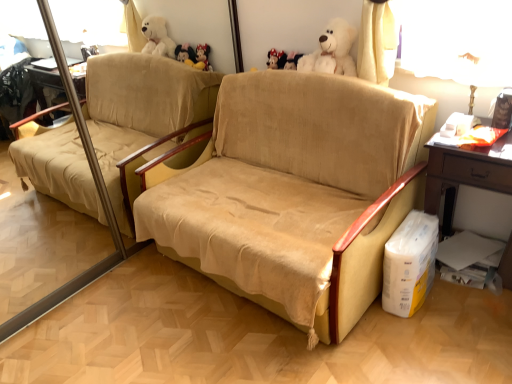
Describe the element at coordinates (465, 173) in the screenshot. This screenshot has width=512, height=384. I see `wooden table at right` at that location.

Where is `fluffy white teddy bear at upper center`? fluffy white teddy bear at upper center is located at coordinates (332, 51).

Find the location of a particular element. The height and width of the screenshot is (384, 512). wooden table at right is located at coordinates (465, 173).

Would you say white cardboard box at lower right is to the left or to the right of beige suede couch at center in the picture?

In the image, white cardboard box at lower right appears on the right side of beige suede couch at center.

Considering the relative sizes of white cardboard box at lower right and beige suede couch at center in the image provided, is white cardboard box at lower right shorter than beige suede couch at center?

Indeed, white cardboard box at lower right has a lesser height compared to beige suede couch at center.

Is white cardboard box at lower right spatially inside beige suede couch at center, or outside of it?

white cardboard box at lower right is not inside beige suede couch at center, it's outside.

In the image, is white cardboard box at lower right positioned in front of or behind metallic gold table lamp at upper right?

white cardboard box at lower right is positioned farther from the viewer than metallic gold table lamp at upper right.

In the scene shown: Considering the relative positions of white cardboard box at lower right and metallic gold table lamp at upper right in the image provided, is white cardboard box at lower right to the left of metallic gold table lamp at upper right from the viewer's perspective?

Indeed, white cardboard box at lower right is positioned on the left side of metallic gold table lamp at upper right.

Is white cardboard box at lower right far away from metallic gold table lamp at upper right?

No, white cardboard box at lower right is not far away from metallic gold table lamp at upper right.

Considering the positions of objects white cardboard box at lower right and wooden table at right in the image provided, who is more to the left, white cardboard box at lower right or wooden table at right?

From the viewer's perspective, white cardboard box at lower right appears more on the left side.

Does white cardboard box at lower right lie behind wooden table at right?

Yes, white cardboard box at lower right is behind wooden table at right.

Does point (414, 250) come in front of point (489, 155)?

No, it is behind (489, 155).

Is white cardboard box at lower right facing away from wooden table at right?

Yes, white cardboard box at lower right's orientation is away from wooden table at right.

Would you say wooden table at right is inside or outside beige suede couch at center?

wooden table at right is located beyond the bounds of beige suede couch at center.

From a real-world perspective, is wooden table at right located beneath beige suede couch at center?

Yes.

Based on the photo, which object is thinner, wooden table at right or beige suede couch at center?

Thinner between the two is wooden table at right.

Is wooden table at right far from beige suede couch at center?

No.

Between metallic gold table lamp at upper right and fluffy white teddy bear at upper center, which one has smaller width?

With smaller width is metallic gold table lamp at upper right.

Considering the relative sizes of metallic gold table lamp at upper right and fluffy white teddy bear at upper center in the image provided, is metallic gold table lamp at upper right taller than fluffy white teddy bear at upper center?

Yes.

Is metallic gold table lamp at upper right closer to the viewer compared to fluffy white teddy bear at upper center?

Yes, metallic gold table lamp at upper right is closer to the camera.

Considering the sizes of metallic gold table lamp at upper right and fluffy white teddy bear at upper center in the image, is metallic gold table lamp at upper right bigger or smaller than fluffy white teddy bear at upper center?

Considering their sizes, metallic gold table lamp at upper right takes up less space than fluffy white teddy bear at upper center.

From the picture: Which of these two, beige suede couch at center or metallic gold table lamp at upper right, is wider?

beige suede couch at center is wider.

From the image's perspective, between beige suede couch at center and metallic gold table lamp at upper right, who is located below?

beige suede couch at center is shown below in the image.

Does beige suede couch at center appear on the right side of metallic gold table lamp at upper right?

Incorrect, beige suede couch at center is not on the right side of metallic gold table lamp at upper right.

Does beige suede couch at center turn towards metallic gold table lamp at upper right?

No, beige suede couch at center is not aimed at metallic gold table lamp at upper right.

In the image, is wooden table at right positioned in front of or behind white cardboard box at lower right?

In the image, wooden table at right appears in front of white cardboard box at lower right.

Considering the positions of objects wooden table at right and white cardboard box at lower right in the image provided, who is more to the right, wooden table at right or white cardboard box at lower right?

wooden table at right is more to the right.

In the scene shown: Is the surface of wooden table at right in direct contact with white cardboard box at lower right?

No, wooden table at right is not next to white cardboard box at lower right.

Is wooden table at right inside the boundaries of white cardboard box at lower right, or outside?

wooden table at right exists outside the volume of white cardboard box at lower right.

Locate an element on the screen. The height and width of the screenshot is (384, 512). cardboard box that appears behind the beige suede couch at center is located at coordinates (409, 264).

You are a GUI agent. You are given a task and a screenshot of the screen. Output one action in this format:
    pyautogui.click(x=<x>, y=<y>)
    Task: Click on the cardboard box that appears below the metallic gold table lamp at upper right (from a real-world perspective)
    
    Given the screenshot: What is the action you would take?
    (409, 264)

When comparing their distances from metallic gold table lamp at upper right, does beige suede couch at center or wooden table at right seem further?

beige suede couch at center.

From the image, which object appears to be farther from fluffy white teddy bear at upper center, wooden table at right or metallic gold table lamp at upper right?

wooden table at right.

Considering their positions, is white cardboard box at lower right positioned further to beige suede couch at center than wooden table at right?

Based on the image, wooden table at right appears to be further to beige suede couch at center.

Based on their spatial positions, is white cardboard box at lower right or fluffy white teddy bear at upper center further from metallic gold table lamp at upper right?

Result: white cardboard box at lower right lies further to metallic gold table lamp at upper right than the other object.

From the image, which object appears to be farther from metallic gold table lamp at upper right, beige suede couch at center or white cardboard box at lower right?

The object further to metallic gold table lamp at upper right is beige suede couch at center.

From the image, which object appears to be farther from wooden table at right, metallic gold table lamp at upper right or fluffy white teddy bear at upper center?

The object further to wooden table at right is fluffy white teddy bear at upper center.

Considering their positions, is metallic gold table lamp at upper right positioned closer to beige suede couch at center than fluffy white teddy bear at upper center?

The object closer to beige suede couch at center is fluffy white teddy bear at upper center.

Which object lies further to the anchor point beige suede couch at center, metallic gold table lamp at upper right or wooden table at right?

metallic gold table lamp at upper right is further to beige suede couch at center.

The width and height of the screenshot is (512, 384). I want to click on cardboard box situated between beige suede couch at center and wooden table at right from left to right, so click(x=409, y=264).

The width and height of the screenshot is (512, 384). In order to click on table lamp between beige suede couch at center and wooden table at right from left to right in this screenshot , I will do `click(476, 73)`.

Locate an element on the screen. table that lies between fluffy white teddy bear at upper center and white cardboard box at lower right from top to bottom is located at coordinates (465, 173).

Image resolution: width=512 pixels, height=384 pixels. What are the coordinates of `table lamp between fluffy white teddy bear at upper center and wooden table at right vertically` in the screenshot? It's located at coord(476,73).